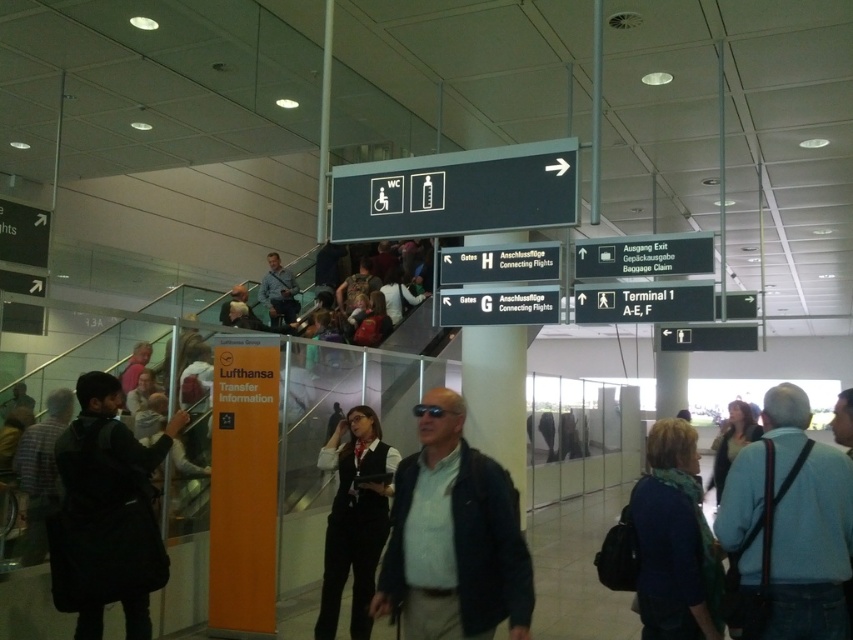
Question: Estimate the real-world distances between objects in this image. Which object is farther from the dark blue sweater at lower right?

Choices:
 (A) light blue shirt at upper center
 (B) white plastic sign at upper center
 (C) black uniform at center

Answer: (A)

Question: Which object is farther from the camera taking this photo?

Choices:
 (A) dark matte jacket at lower left
 (B) dark blue sweater at lower right
 (C) light blue shirt at upper center

Answer: (C)

Question: Can you confirm if blue fabric shirt at center is positioned to the left of black uniform at center?

Choices:
 (A) no
 (B) yes

Answer: (A)

Question: Does dark matte jacket at lower left have a lesser width compared to black plastic sign at upper center?

Choices:
 (A) no
 (B) yes

Answer: (B)

Question: Based on their relative distances, which object is nearer to the dark matte jacket at lower left?

Choices:
 (A) blue fabric shirt at center
 (B) light blue shirt at upper center

Answer: (A)

Question: Does blue fabric shirt at center have a larger size compared to light blue shirt at upper center?

Choices:
 (A) yes
 (B) no

Answer: (B)